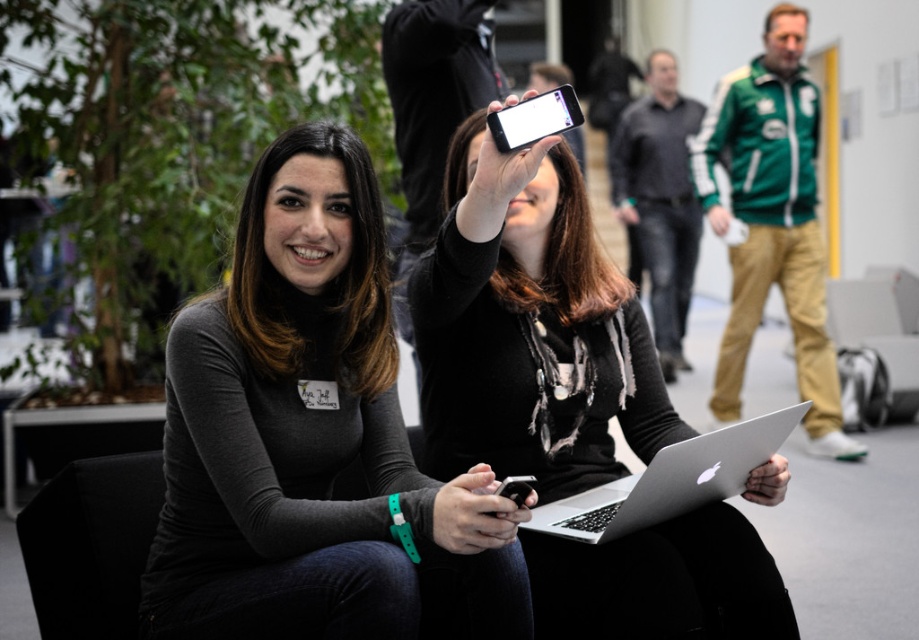
Who is shorter, matte black phone at center or light skin flesh at center?

light skin flesh at center

The width and height of the screenshot is (919, 640). Describe the element at coordinates (475, 513) in the screenshot. I see `matte black phone at center` at that location.

You are a GUI agent. You are given a task and a screenshot of the screen. Output one action in this format:
    pyautogui.click(x=<x>, y=<y>)
    Task: Click on the matte black phone at center
    This screenshot has height=640, width=919.
    Given the screenshot: What is the action you would take?
    pyautogui.click(x=475, y=513)

Identify the location of matte black phone at center. The height and width of the screenshot is (640, 919). (475, 513).

Does matte black sweater at center appear on the left side of white glossy phone at upper center?

Yes, matte black sweater at center is to the left of white glossy phone at upper center.

Does matte black sweater at center appear under white glossy phone at upper center?

Yes, matte black sweater at center is below white glossy phone at upper center.

The height and width of the screenshot is (640, 919). Describe the element at coordinates (305, 436) in the screenshot. I see `matte black sweater at center` at that location.

Find the location of a particular element. matte black sweater at center is located at coordinates (305, 436).

Is matte black scarf at center taller than light skin flesh at center?

Correct, matte black scarf at center is much taller as light skin flesh at center.

Is matte black scarf at center bigger than light skin flesh at center?

Correct, matte black scarf at center is larger in size than light skin flesh at center.

Describe the element at coordinates (530, 330) in the screenshot. I see `matte black scarf at center` at that location.

Find the location of a particular element. The height and width of the screenshot is (640, 919). matte black scarf at center is located at coordinates (530, 330).